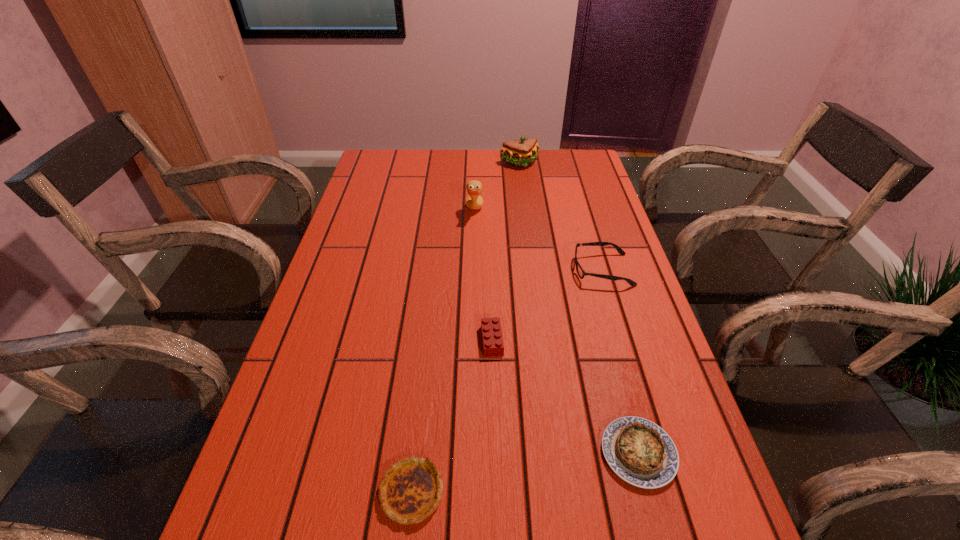
Where is `free space located on the beak of the duck`? free space located on the beak of the duck is located at coordinates (577, 211).

The height and width of the screenshot is (540, 960). I want to click on free space located 0.200m on the front-facing side of the third tallest object, so click(498, 270).

Identify the location of blank space located on the front-facing side of the third tallest object. This screenshot has height=540, width=960. (540, 270).

I want to click on free space located on the front-facing side of the third tallest object, so click(555, 270).

At what (x,y) coordinates should I click in order to perform the action: click on free space located on the left of the third nearest object. Please return your answer as a coordinate pair (x, y). The image size is (960, 540). Looking at the image, I should click on (445, 341).

Locate an element on the screen. free spot located 0.110m on the left of the right quiche is located at coordinates (540, 453).

Locate an element on the screen. vacant area located on the left of the left quiche is located at coordinates (332, 491).

Locate an element on the screen. This screenshot has width=960, height=540. object present at the far edge is located at coordinates (521, 153).

You are a GUI agent. You are given a task and a screenshot of the screen. Output one action in this format:
    pyautogui.click(x=<x>, y=<y>)
    Task: Click on the spectacles situated at the right edge
    
    Given the screenshot: What is the action you would take?
    pyautogui.click(x=581, y=273)

At what (x,y) coordinates should I click in order to perform the action: click on quiche present at the right edge. Please return your answer as a coordinate pair (x, y). Looking at the image, I should click on (640, 452).